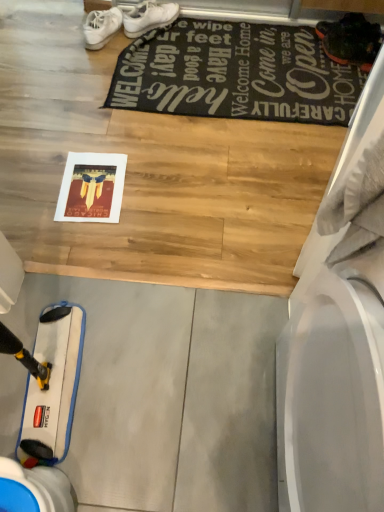
Question: Would you consider black fabric mat at upper center to be distant from white matte sneakers at upper center?

Choices:
 (A) yes
 (B) no

Answer: (B)

Question: Is black fabric mat at upper center smaller than white matte sneakers at upper center?

Choices:
 (A) no
 (B) yes

Answer: (A)

Question: From a real-world perspective, is black fabric mat at upper center on white matte sneakers at upper center?

Choices:
 (A) yes
 (B) no

Answer: (B)

Question: From a real-world perspective, is black fabric mat at upper center below white matte sneakers at upper center?

Choices:
 (A) yes
 (B) no

Answer: (A)

Question: Is black fabric mat at upper center in front of white matte sneakers at upper center?

Choices:
 (A) no
 (B) yes

Answer: (B)

Question: Does black fabric mat at upper center lie behind white matte sneakers at upper center?

Choices:
 (A) yes
 (B) no

Answer: (B)

Question: Considering the relative positions of white matte sneakers at upper center and black fabric mat at upper center in the image provided, is white matte sneakers at upper center to the left of black fabric mat at upper center from the viewer's perspective?

Choices:
 (A) yes
 (B) no

Answer: (A)

Question: From a real-world perspective, is white matte sneakers at upper center positioned over black fabric mat at upper center based on gravity?

Choices:
 (A) no
 (B) yes

Answer: (B)

Question: Is white matte sneakers at upper center thinner than black fabric mat at upper center?

Choices:
 (A) no
 (B) yes

Answer: (B)

Question: Are white matte sneakers at upper center and black fabric mat at upper center located far from each other?

Choices:
 (A) no
 (B) yes

Answer: (A)

Question: Is white matte sneakers at upper center at the right side of black fabric mat at upper center?

Choices:
 (A) no
 (B) yes

Answer: (A)

Question: Does white matte sneakers at upper center have a greater height compared to black fabric mat at upper center?

Choices:
 (A) yes
 (B) no

Answer: (A)

Question: Does point (84, 22) appear closer or farther from the camera than point (137, 80)?

Choices:
 (A) farther
 (B) closer

Answer: (A)